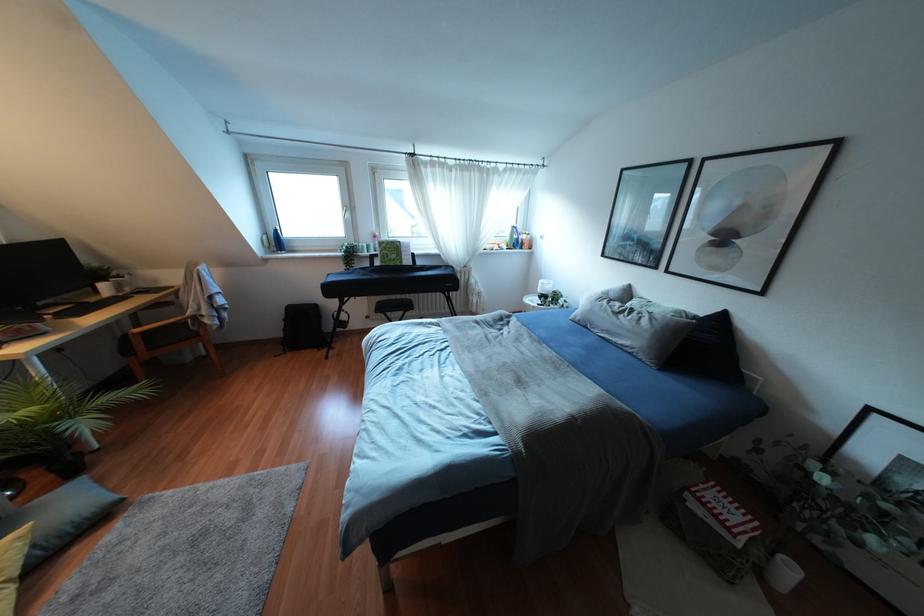
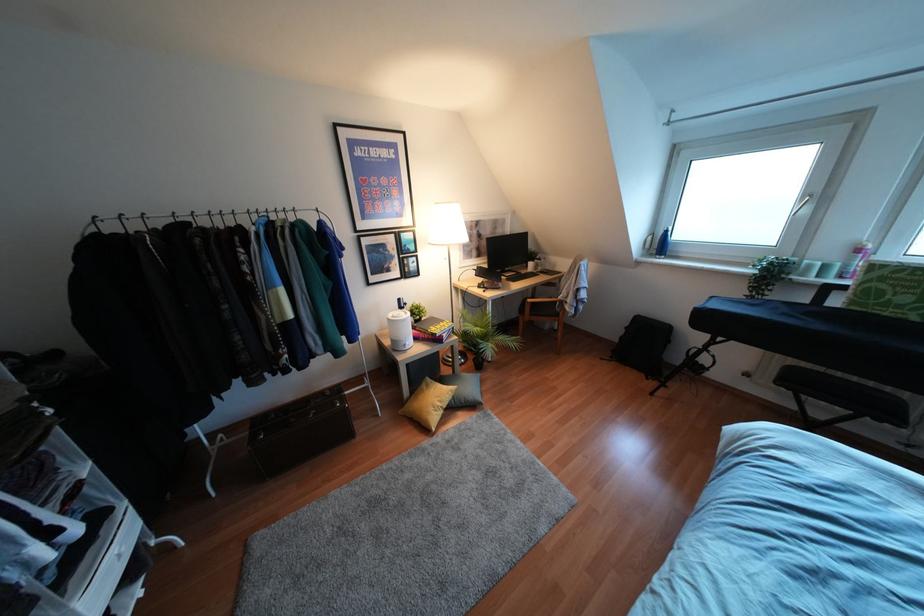
The point at (284, 329) is marked in the first image. Where is the corresponding point in the second image?

(621, 337)